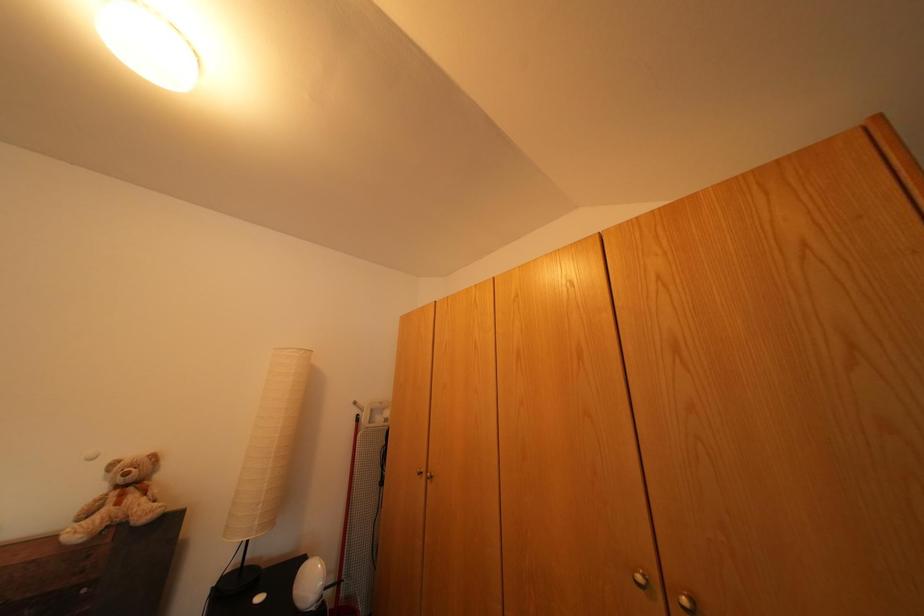
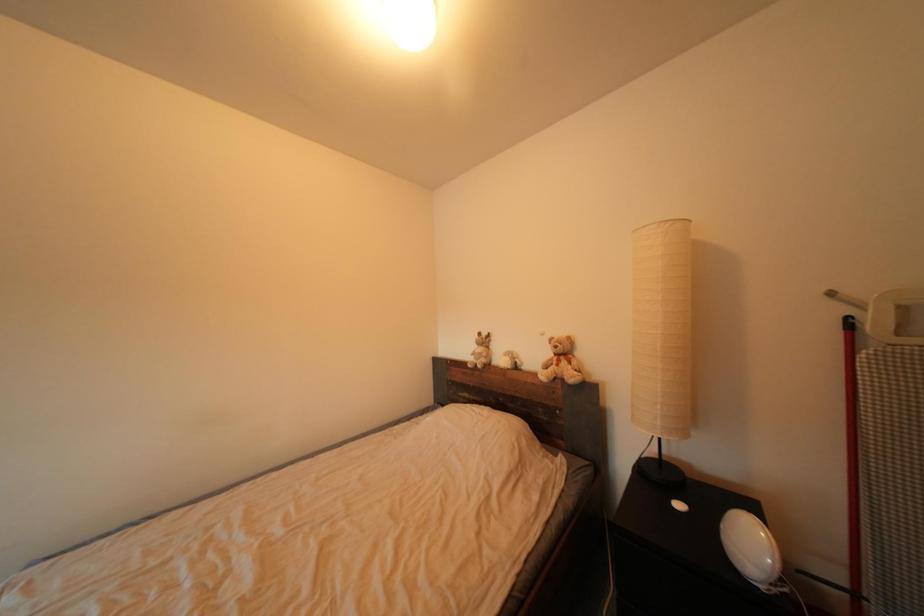
Question: Based on the continuous images, in which direction is the camera rotating? Reply with the corresponding letter.

Choices:
 (A) Left
 (B) Right
 (C) Up
 (D) Down

Answer: (A)